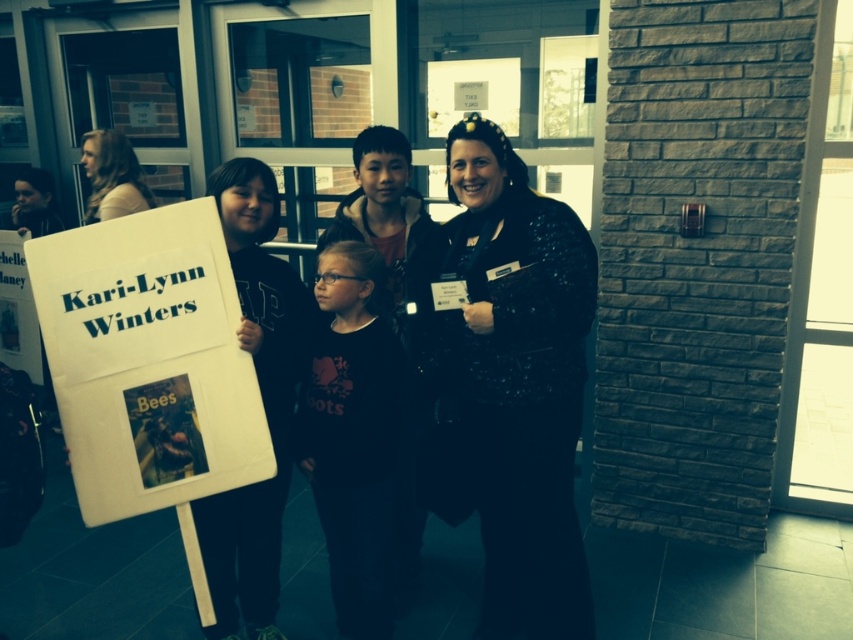
You are a photographer setting up for a group photo. You notice the matte black jacket at center and the blonde hair at upper left. Which object should you adjust to ensure both are fully visible in the frame?

The matte black jacket at center is in front of the blonde hair at upper left, so you should adjust the matte black jacket at center to move it out of the way so the blonde hair at upper left becomes visible.

You are organizing a craft activity where the black sequined sweater at center and the white paper at center are part of the materials. Since the sweater is larger, how might you arrange them to ensure both are visible to participants?

Place the black sequined sweater at center on a raised surface so it towers over the white paper at center, ensuring both items are clearly visible to participants.